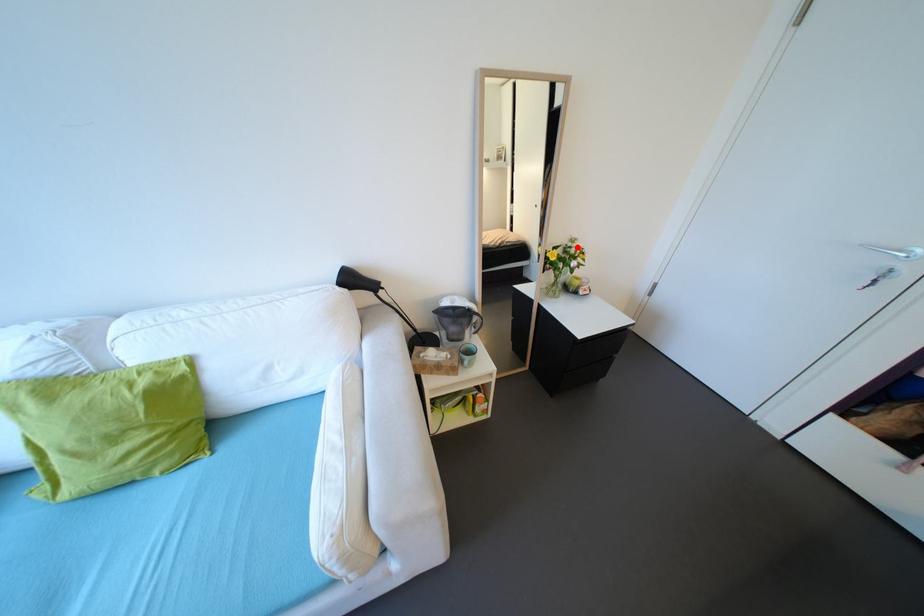
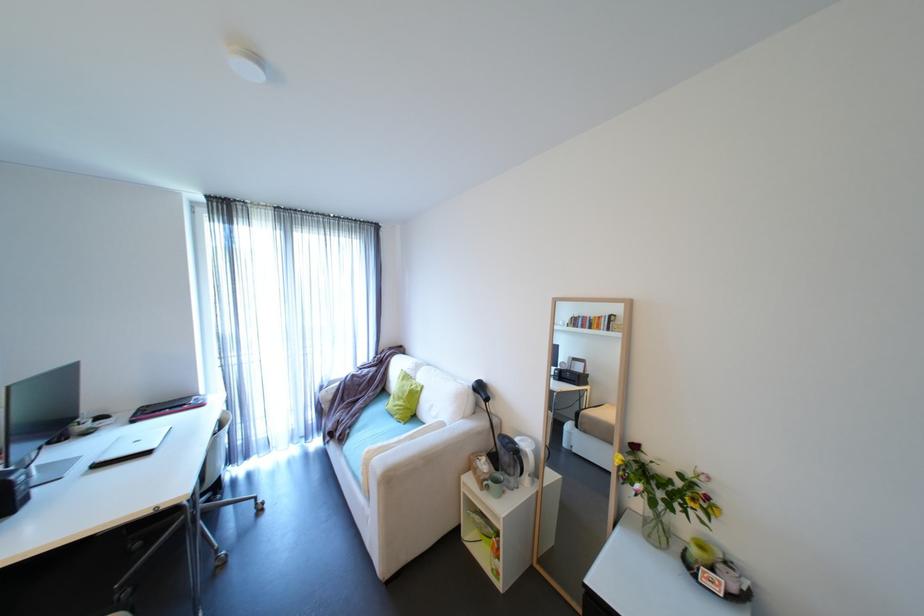
The point at the highlighted location is marked in the first image. Where is the corresponding point in the second image?

(703, 485)